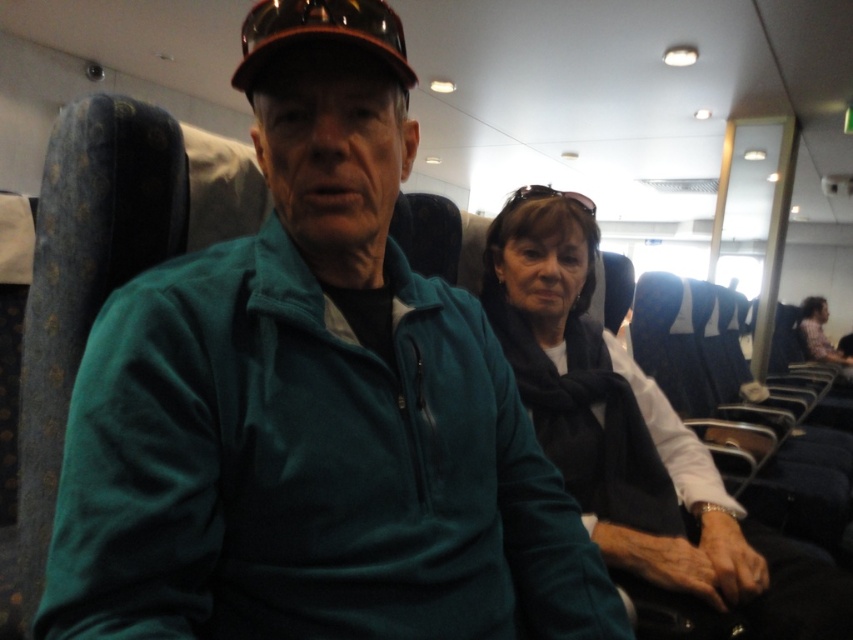
Does black fabric scarf at center appear over brown matte baseball cap at upper center?

Actually, black fabric scarf at center is below brown matte baseball cap at upper center.

How distant is black fabric scarf at center from brown matte baseball cap at upper center?

black fabric scarf at center and brown matte baseball cap at upper center are 30.67 inches apart from each other.

Which is in front, point (543, 380) or point (328, 3)?

Point (328, 3)

Image resolution: width=853 pixels, height=640 pixels. In order to click on black fabric scarf at center in this screenshot , I will do `click(637, 444)`.

Is point (265, 243) less distant than point (811, 301)?

That is True.

Between teal fleece jacket at center and dark gray scarf at center, which one appears on the right side from the viewer's perspective?

From the viewer's perspective, dark gray scarf at center appears more on the right side.

Locate an element on the screen. This screenshot has width=853, height=640. teal fleece jacket at center is located at coordinates (312, 420).

Is teal fleece jacket at center taller than black fabric scarf at center?

In fact, teal fleece jacket at center may be shorter than black fabric scarf at center.

You are a GUI agent. You are given a task and a screenshot of the screen. Output one action in this format:
    pyautogui.click(x=<x>, y=<y>)
    Task: Click on the teal fleece jacket at center
    The image size is (853, 640).
    Given the screenshot: What is the action you would take?
    pyautogui.click(x=312, y=420)

The width and height of the screenshot is (853, 640). I want to click on teal fleece jacket at center, so click(312, 420).